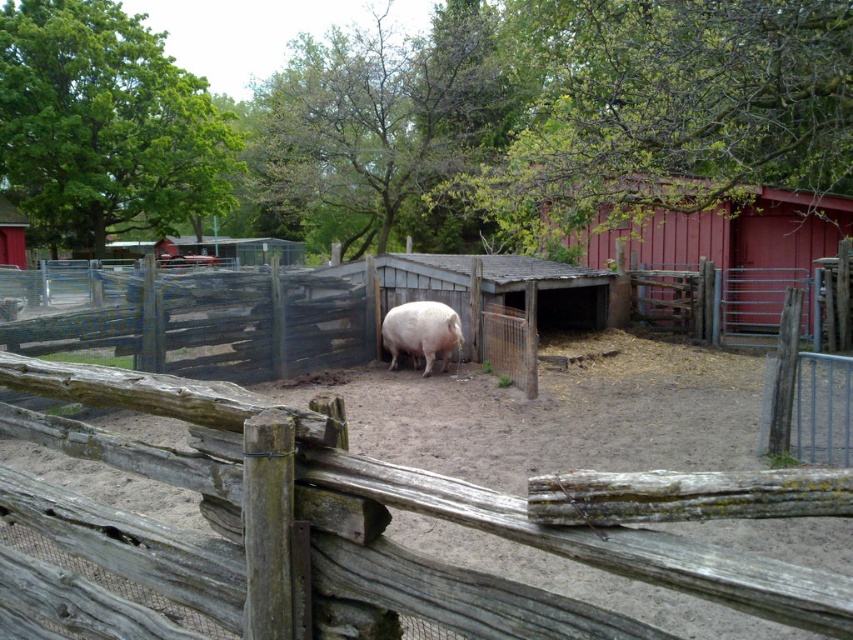
This screenshot has width=853, height=640. What do you see at coordinates (213, 323) in the screenshot?
I see `wooden fence at left` at bounding box center [213, 323].

I want to click on wooden fence at left, so click(x=213, y=323).

The image size is (853, 640). I want to click on wooden fence at left, so click(213, 323).

In the scene shown: Is weathered wood fence at center above pink matte pig at center?

Actually, weathered wood fence at center is below pink matte pig at center.

Locate an element on the screen. This screenshot has height=640, width=853. weathered wood fence at center is located at coordinates (610, 545).

This screenshot has width=853, height=640. In order to click on weathered wood fence at center in this screenshot , I will do `click(610, 545)`.

Which is in front, point (457, 504) or point (805, 250)?

Point (457, 504)

Find the location of a particular element. This screenshot has height=640, width=853. weathered wood fence at center is located at coordinates (610, 545).